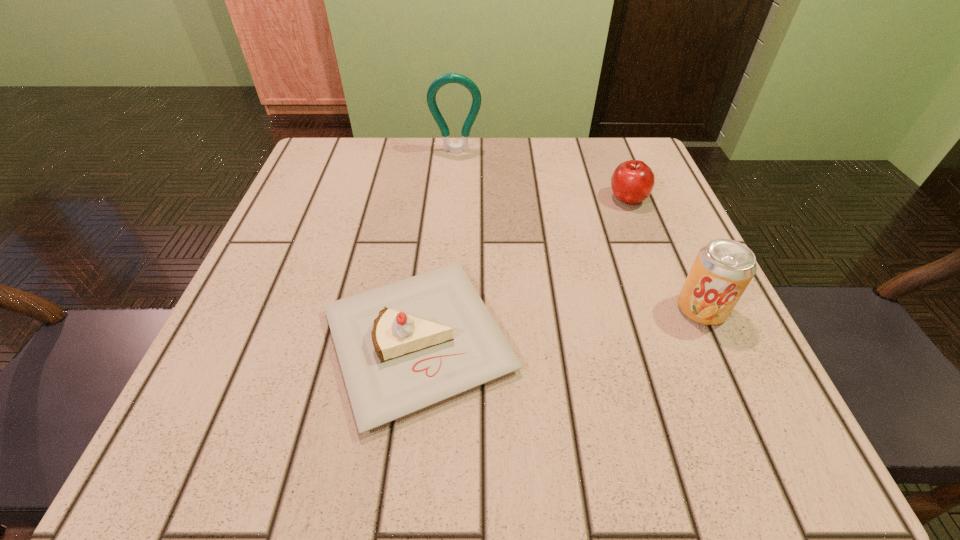
The width and height of the screenshot is (960, 540). Find the location of `the tallest object`. the tallest object is located at coordinates (452, 77).

I want to click on bottle opener, so click(452, 77).

At what (x,y) coordinates should I click in order to perform the action: click on the second tallest object. Please return your answer as a coordinate pair (x, y). The width and height of the screenshot is (960, 540). Looking at the image, I should click on (723, 268).

In order to click on the third tallest object in this screenshot , I will do `click(632, 182)`.

You are a GUI agent. You are given a task and a screenshot of the screen. Output one action in this format:
    pyautogui.click(x=<x>, y=<y>)
    Task: Click on the third nearest object
    The width and height of the screenshot is (960, 540).
    Given the screenshot: What is the action you would take?
    pyautogui.click(x=632, y=182)

Locate an element on the screen. This screenshot has width=960, height=540. cake is located at coordinates click(x=402, y=347).

I want to click on vacant space located at the jaws of the bottle opener, so click(x=448, y=264).

Identify the location of vacant region located 0.200m on the front of the pop (soda). (771, 462).

Find the location of a particular element. This screenshot has width=960, height=540. vacant space situated on the left of the third nearest object is located at coordinates (564, 198).

You are a GUI agent. You are given a task and a screenshot of the screen. Output one action in this format:
    pyautogui.click(x=<x>, y=<y>)
    Task: Click on the free point located 0.090m on the back of the shortest object
    The image size is (960, 540).
    Given the screenshot: What is the action you would take?
    pyautogui.click(x=431, y=235)